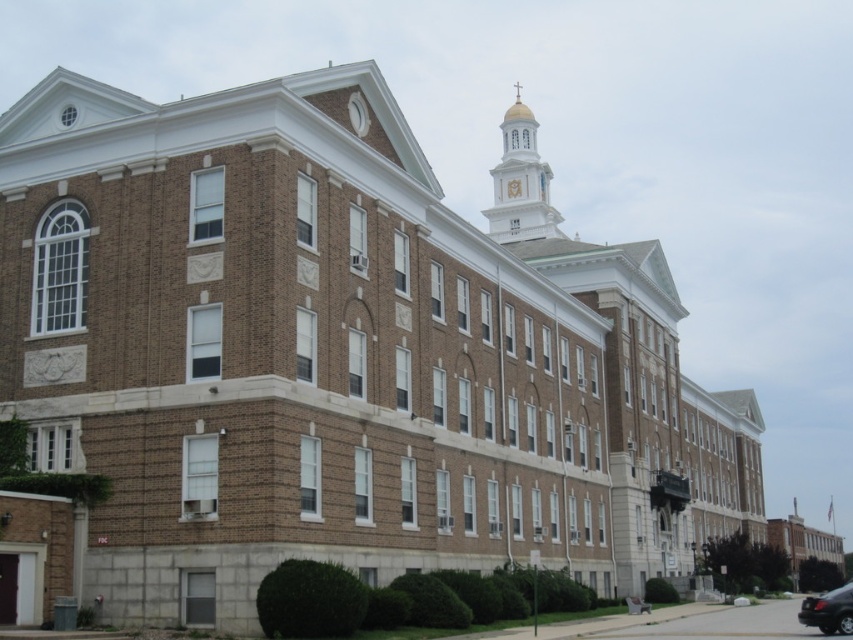
Is point (492, 184) positioned before point (851, 609)?

No, (492, 184) is further to viewer.

Does white glossy bell tower at upper center have a larger size compared to shiny black car at lower right?

Yes, white glossy bell tower at upper center is bigger than shiny black car at lower right.

Describe the element at coordinates (520, 180) in the screenshot. Image resolution: width=853 pixels, height=640 pixels. I see `white glossy bell tower at upper center` at that location.

Identify the location of white glossy bell tower at upper center. The image size is (853, 640). (520, 180).